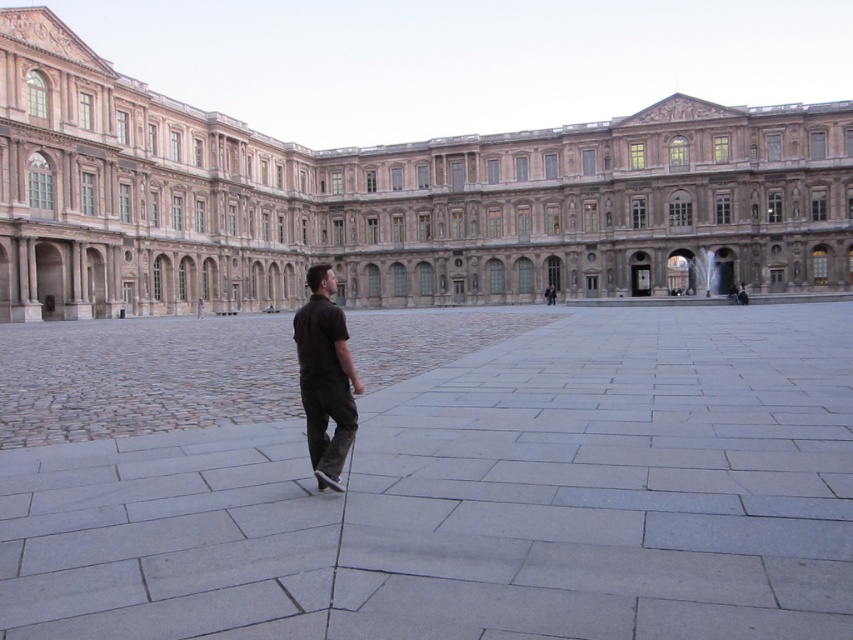
Does point (735, 364) come behind point (657, 198)?

No, it is not.

The image size is (853, 640). Describe the element at coordinates (479, 500) in the screenshot. I see `gray stone courtyard at center` at that location.

Image resolution: width=853 pixels, height=640 pixels. Describe the element at coordinates (479, 500) in the screenshot. I see `gray stone courtyard at center` at that location.

Locate an element on the screen. The height and width of the screenshot is (640, 853). gray stone courtyard at center is located at coordinates (479, 500).

Can you confirm if gray stone courtyard at center is positioned to the right of dark brown shirt at center?

Indeed, gray stone courtyard at center is positioned on the right side of dark brown shirt at center.

Can you confirm if gray stone courtyard at center is thinner than dark brown shirt at center?

Incorrect, gray stone courtyard at center's width is not less than dark brown shirt at center's.

Is point (218, 436) more distant than point (312, 282)?

Yes, point (218, 436) is behind point (312, 282).

The image size is (853, 640). I want to click on gray stone courtyard at center, so click(x=479, y=500).

Which is more to the left, beige stone palace at center or dark brown shirt at center?

dark brown shirt at center is more to the left.

Can you confirm if beige stone palace at center is positioned to the right of dark brown shirt at center?

Indeed, beige stone palace at center is positioned on the right side of dark brown shirt at center.

Between point (57, 64) and point (354, 406), which one is positioned in front?

Point (354, 406)

What are the coordinates of `beige stone palace at center` in the screenshot? It's located at (393, 200).